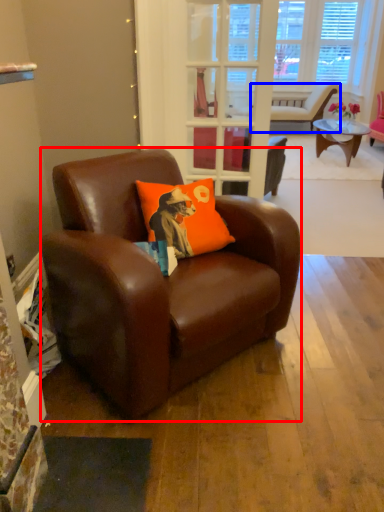
Question: Which object is closer to the camera taking this photo, chair (highlighted by a red box) or chair (highlighted by a blue box)?

Choices:
 (A) chair
 (B) chair

Answer: (A)